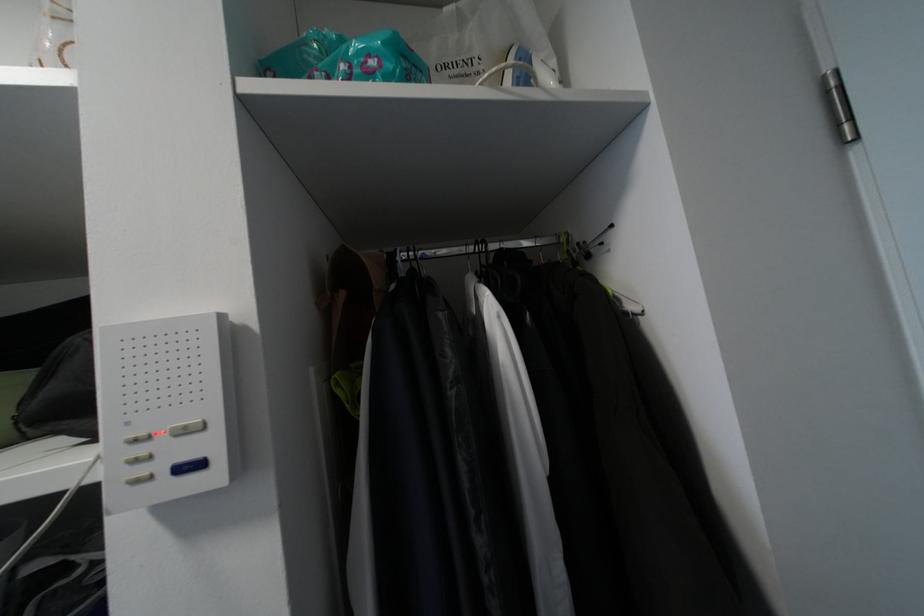
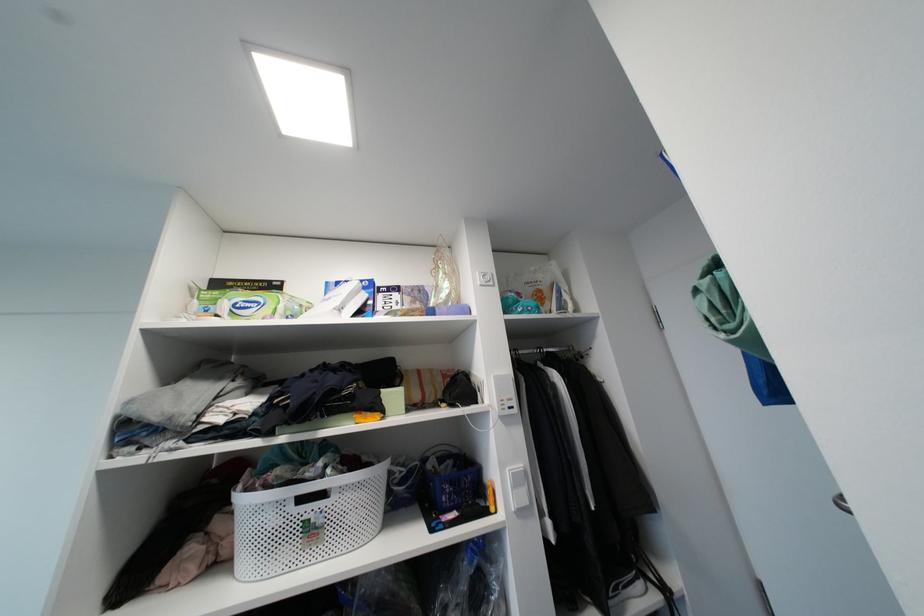
Find the pixel in the second image that matches pixel 146 450 in the first image.

(506, 403)